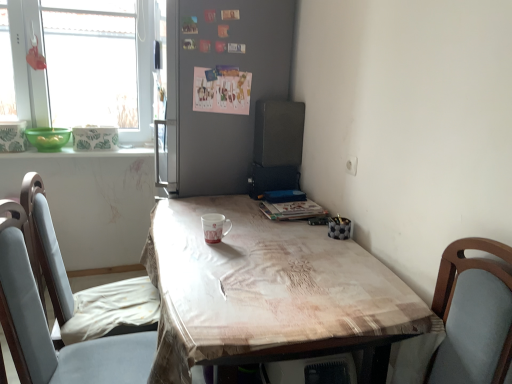
I want to click on free space behind white glossy mug at center, so click(227, 228).